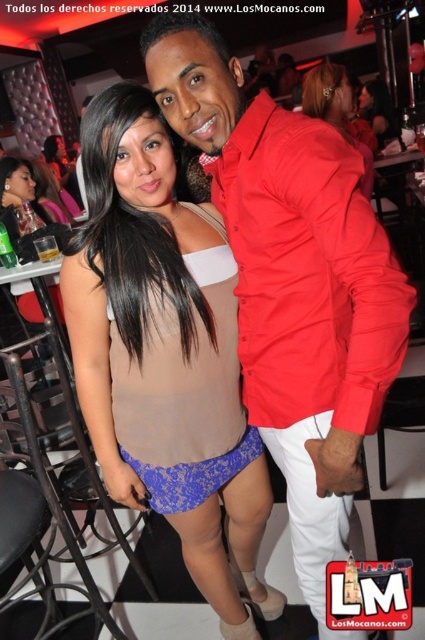
Question: Which point appears farthest from the camera in this image?

Choices:
 (A) (34, 161)
 (B) (343, 132)
 (C) (209, 378)
 (D) (385, 394)

Answer: (A)

Question: Can you confirm if matte red shirt at center is positioned to the right of matte beige lingerie at center?

Choices:
 (A) no
 (B) yes

Answer: (B)

Question: Does matte red blouse at upper right appear under matte beige lingerie at center?

Choices:
 (A) yes
 (B) no

Answer: (A)

Question: Among these points, which one is farthest from the camera?

Choices:
 (A) (360, 180)
 (B) (357, 371)
 (C) (227, 362)

Answer: (C)

Question: Is sheer beige fabric at center positioned behind matte red blouse at upper right?

Choices:
 (A) yes
 (B) no

Answer: (A)

Question: Considering the real-world distances, which object is closest to the matte red blouse at upper right?

Choices:
 (A) matte beige top at center
 (B) sheer beige fabric at center
 (C) matte red shirt at center
 (D) matte beige lingerie at center

Answer: (C)